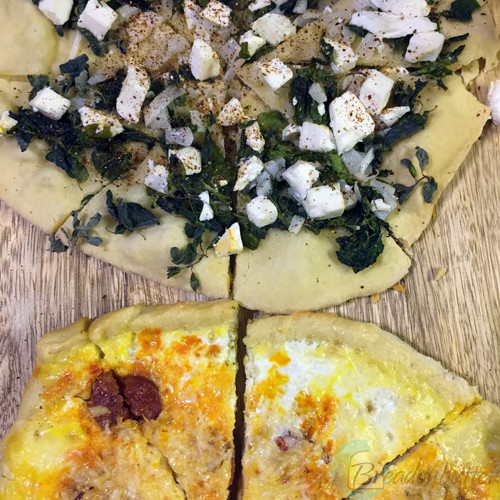
Locate an element on the screen. The height and width of the screenshot is (500, 500). table in middle left side of pizzas is located at coordinates (55, 273).